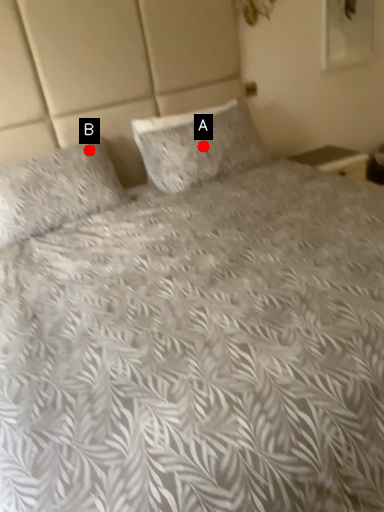
Question: Two points are circled on the image, labeled by A and B beside each circle. Which point is closer to the camera?

Choices:
 (A) A is closer
 (B) B is closer

Answer: (B)